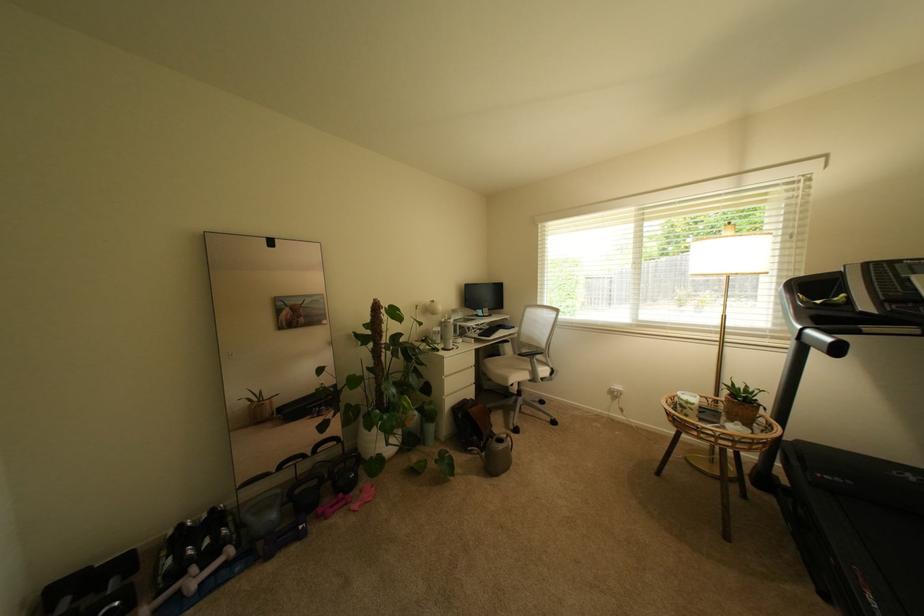
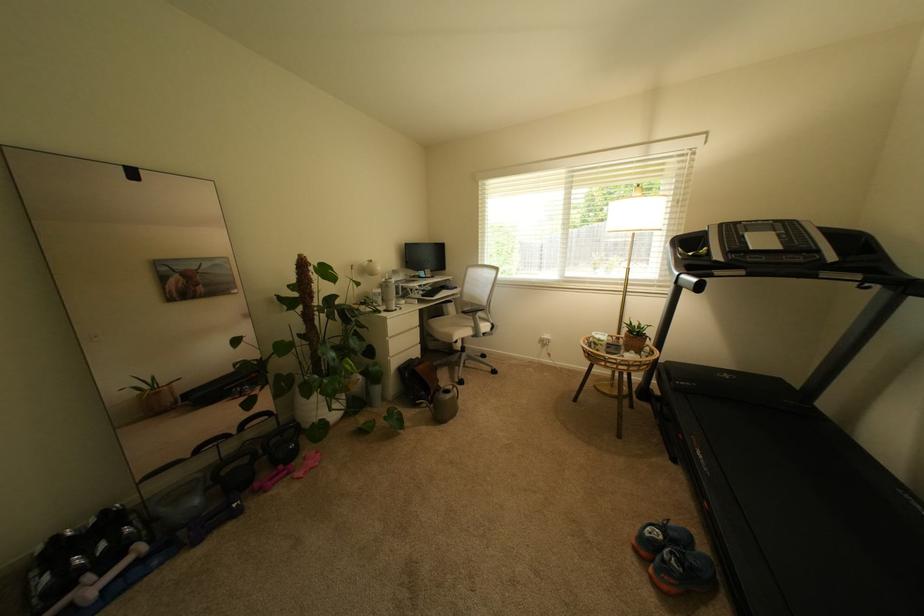
The point at [690,248] is marked in the first image. Where is the corresponding point in the second image?

(608, 217)